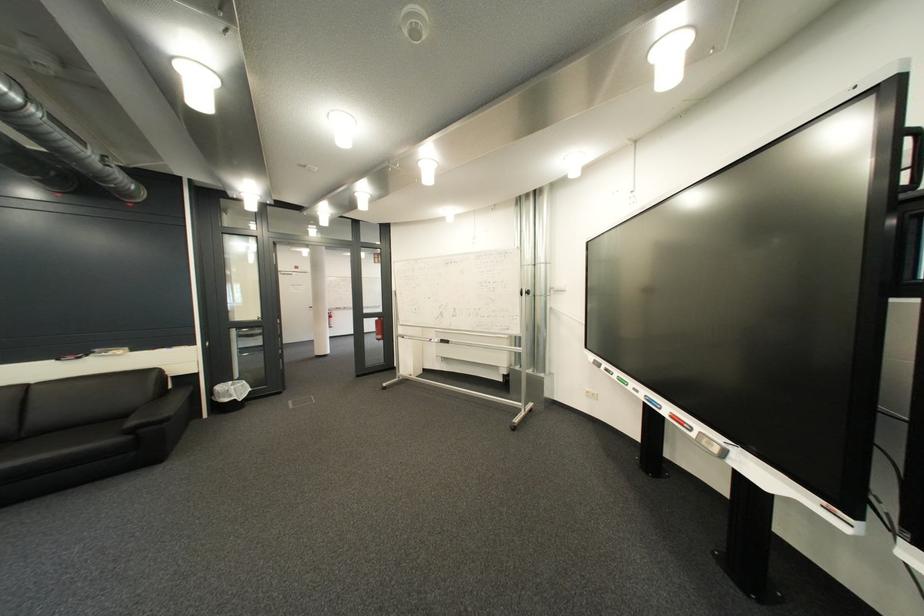
This screenshot has width=924, height=616. In order to click on black door handle in this screenshot , I will do `click(524, 292)`.